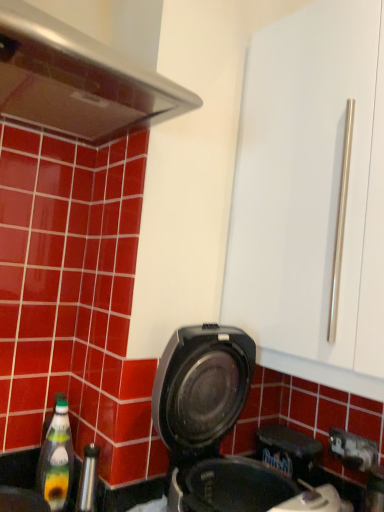
Question: In terms of height, does green glass bottle at lower left look taller or shorter compared to transparent plastic bottle at lower left?

Choices:
 (A) tall
 (B) short

Answer: (A)

Question: Visually, is green glass bottle at lower left positioned to the left or to the right of transparent plastic bottle at lower left?

Choices:
 (A) left
 (B) right

Answer: (B)

Question: Estimate the real-world distances between objects in this image. Which object is closer to the green glass bottle at lower left?

Choices:
 (A) transparent plastic bottle at lower left
 (B) black plastic waffle maker at lower center

Answer: (A)

Question: Which is nearer to the green glass bottle at lower left?

Choices:
 (A) transparent plastic bottle at lower left
 (B) black plastic waffle maker at lower center

Answer: (A)